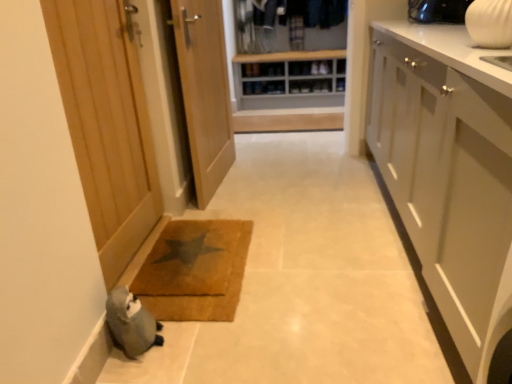
Measure the distance between point (123, 318) and camera.

Point (123, 318) and camera are 1.40 meters apart from each other.

Image resolution: width=512 pixels, height=384 pixels. What do you see at coordinates (204, 91) in the screenshot?
I see `wooden door at center, which is counted as the first door, starting from the right` at bounding box center [204, 91].

You are a GUI agent. You are given a task and a screenshot of the screen. Output one action in this format:
    pyautogui.click(x=<x>, y=<y>)
    Task: Click on the wooden shoe rack at center
    This screenshot has height=384, width=512.
    Given the screenshot: What is the action you would take?
    pyautogui.click(x=287, y=74)

In the scene shown: Is there a large distance between wooden door at left, the second door from the right, and wooden shoe rack at center?

Indeed, wooden door at left, the second door from the right, is not near wooden shoe rack at center.

From a real-world perspective, is wooden door at left, the second door from the right, positioned above or below wooden shoe rack at center?

Clearly, from a real-world perspective, wooden door at left, the second door from the right, is above wooden shoe rack at center.

Which object is positioned more to the right, wooden door at left, the second door from the right, or wooden shoe rack at center?

From the viewer's perspective, wooden shoe rack at center appears more on the right side.

Is wooden door at center, which is counted as the first door, starting from the right, in contact with white matte cabinet at right?

No, wooden door at center, which is counted as the first door, starting from the right, is not with white matte cabinet at right.

Is wooden door at center, marked as the second door in a left-to-right arrangement, oriented towards white matte cabinet at right?

Yes, wooden door at center, marked as the second door in a left-to-right arrangement, faces towards white matte cabinet at right.

Is wooden door at center, which is counted as the first door, starting from the right, at the right side of white matte cabinet at right?

No, wooden door at center, which is counted as the first door, starting from the right, is not to the right of white matte cabinet at right.

In the scene shown: Is the depth of wooden door at center, marked as the second door in a left-to-right arrangement, greater than that of white matte cabinet at right?

Yes, wooden door at center, marked as the second door in a left-to-right arrangement, is further from the viewer.

Measure the distance between white matte cabinet at right and braided brown mat at lower center.

91.74 centimeters.

Does white matte cabinet at right have a lesser height compared to braided brown mat at lower center?

Incorrect, the height of white matte cabinet at right does not fall short of that of braided brown mat at lower center.

From the image's perspective, is white matte cabinet at right under braided brown mat at lower center?

No.

Which is less distant, (x=483, y=151) or (x=163, y=268)?

Point (x=483, y=151).

How distant is wooden shoe rack at center from wooden door at center, which is counted as the first door, starting from the right?

wooden shoe rack at center and wooden door at center, which is counted as the first door, starting from the right, are 4.53 feet apart from each other.

Image resolution: width=512 pixels, height=384 pixels. I want to click on the 1st door in front of the wooden shoe rack at center, so click(x=204, y=91).

In the scene shown: Is wooden shoe rack at center thinner than wooden door at center, marked as the second door in a left-to-right arrangement?

Incorrect, the width of wooden shoe rack at center is not less than that of wooden door at center, marked as the second door in a left-to-right arrangement.

Considering the sizes of objects wooden shoe rack at center and wooden door at center, marked as the second door in a left-to-right arrangement, in the image provided, who is bigger, wooden shoe rack at center or wooden door at center, marked as the second door in a left-to-right arrangement,?

Bigger between the two is wooden shoe rack at center.

From a real-world perspective, between wooden shoe rack at center and braided brown mat at lower center, who is vertically higher?

wooden shoe rack at center is physically above.

Consider the image. Would you say wooden shoe rack at center is a long distance from braided brown mat at lower center?

Yes, wooden shoe rack at center and braided brown mat at lower center are located far from each other.

Who is bigger, wooden shoe rack at center or braided brown mat at lower center?

wooden shoe rack at center is bigger.

Identify the location of closet on the right of braided brown mat at lower center. (287, 74).

Is braided brown mat at lower center with wooden door at left, the second door from the right?

No, braided brown mat at lower center is not in contact with wooden door at left, the second door from the right.

Is braided brown mat at lower center positioned in front of wooden door at left, which appears as the first door when viewed from the left?

No, the depth of braided brown mat at lower center is greater than that of wooden door at left, which appears as the first door when viewed from the left.

Between point (170, 299) and point (103, 237), which one is positioned behind?

The point (170, 299) is behind.

Does braided brown mat at lower center turn towards wooden door at left, the second door from the right?

No, braided brown mat at lower center is not oriented towards wooden door at left, the second door from the right.

From the image's perspective, is white matte cabinet at right beneath wooden shoe rack at center?

Yes, from the image's perspective, white matte cabinet at right is beneath wooden shoe rack at center.

Is white matte cabinet at right at the right side of wooden shoe rack at center?

Yes.

Does white matte cabinet at right touch wooden shoe rack at center?

There is a gap between white matte cabinet at right and wooden shoe rack at center.

Image resolution: width=512 pixels, height=384 pixels. I want to click on cabinetry below the wooden shoe rack at center (from the image's perspective), so click(447, 173).

The image size is (512, 384). Identify the location of the 2nd door counting from the left of the wooden shoe rack at center. (106, 124).

Image resolution: width=512 pixels, height=384 pixels. Find the location of `the 1st door located above the white matte cabinet at right (from a real-world perspective)`. the 1st door located above the white matte cabinet at right (from a real-world perspective) is located at coordinates (204, 91).

Considering their positions, is white matte cabinet at right positioned closer to wooden door at center, marked as the second door in a left-to-right arrangement, than gray knitted stuffed animal at lower left?

white matte cabinet at right lies closer to wooden door at center, marked as the second door in a left-to-right arrangement, than the other object.

When comparing their distances from white matte cabinet at right, does gray knitted stuffed animal at lower left or braided brown mat at lower center seem closer?

Among the two, braided brown mat at lower center is located nearer to white matte cabinet at right.

Based on their spatial positions, is gray knitted stuffed animal at lower left or white matte cabinet at right further from braided brown mat at lower center?

white matte cabinet at right lies further to braided brown mat at lower center than the other object.

Based on their spatial positions, is gray knitted stuffed animal at lower left or wooden door at center, marked as the second door in a left-to-right arrangement, further from white matte cabinet at right?

wooden door at center, marked as the second door in a left-to-right arrangement, is further to white matte cabinet at right.

When comparing their distances from white matte cabinet at right, does braided brown mat at lower center or wooden door at center, marked as the second door in a left-to-right arrangement, seem further?

wooden door at center, marked as the second door in a left-to-right arrangement.

From the image, which object appears to be farther from gray knitted stuffed animal at lower left, braided brown mat at lower center or wooden door at left, the second door from the right?

wooden door at left, the second door from the right, is positioned further to the anchor gray knitted stuffed animal at lower left.

Based on their spatial positions, is wooden shoe rack at center or braided brown mat at lower center closer to white matte cabinet at right?

braided brown mat at lower center is positioned closer to the anchor white matte cabinet at right.

Based on their spatial positions, is wooden door at left, the second door from the right, or braided brown mat at lower center closer to wooden door at center, marked as the second door in a left-to-right arrangement?

wooden door at left, the second door from the right, is closer to wooden door at center, marked as the second door in a left-to-right arrangement.

I want to click on door between wooden door at center, marked as the second door in a left-to-right arrangement, and gray knitted stuffed animal at lower left from top to bottom, so click(106, 124).

You are a GUI agent. You are given a task and a screenshot of the screen. Output one action in this format:
    pyautogui.click(x=<x>, y=<y>)
    Task: Click on the mat located between wooden door at left, the second door from the right, and wooden shoe rack at center in the depth direction
    
    Given the screenshot: What is the action you would take?
    pyautogui.click(x=195, y=270)

At what (x,y) coordinates should I click in order to perform the action: click on animal situated between wooden door at left, which appears as the first door when viewed from the left, and white matte cabinet at right from left to right. Please return your answer as a coordinate pair (x, y). The image size is (512, 384). Looking at the image, I should click on (131, 323).

Image resolution: width=512 pixels, height=384 pixels. What are the coordinates of `door positioned between wooden door at left, which appears as the first door when viewed from the left, and wooden shoe rack at center from near to far` in the screenshot? It's located at (204, 91).